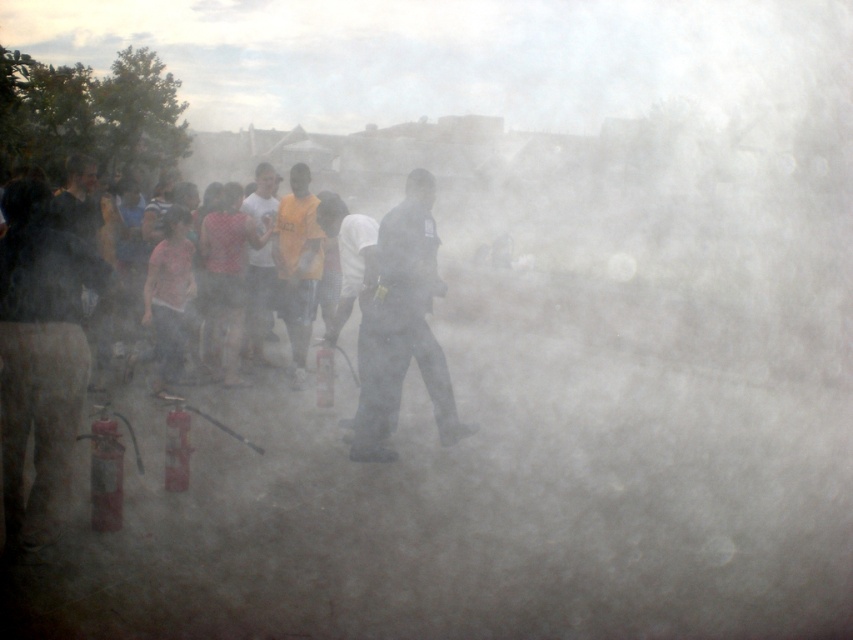
Question: Which point is farther to the camera?

Choices:
 (A) dark uniformed figure at center
 (B) white matte shirt at center

Answer: (B)

Question: Is dark uniformed figure at center smaller than white matte shirt at center?

Choices:
 (A) no
 (B) yes

Answer: (A)

Question: Which point is closer to the camera?

Choices:
 (A) white matte shirt at center
 (B) dark uniformed figure at center

Answer: (B)

Question: In this image, where is dark uniformed figure at center located relative to white matte shirt at center?

Choices:
 (A) above
 (B) below

Answer: (B)

Question: Is dark uniformed figure at center positioned before white matte shirt at center?

Choices:
 (A) no
 (B) yes

Answer: (B)

Question: Which object is closer to the camera taking this photo?

Choices:
 (A) dark uniformed figure at center
 (B) white matte shirt at center

Answer: (A)